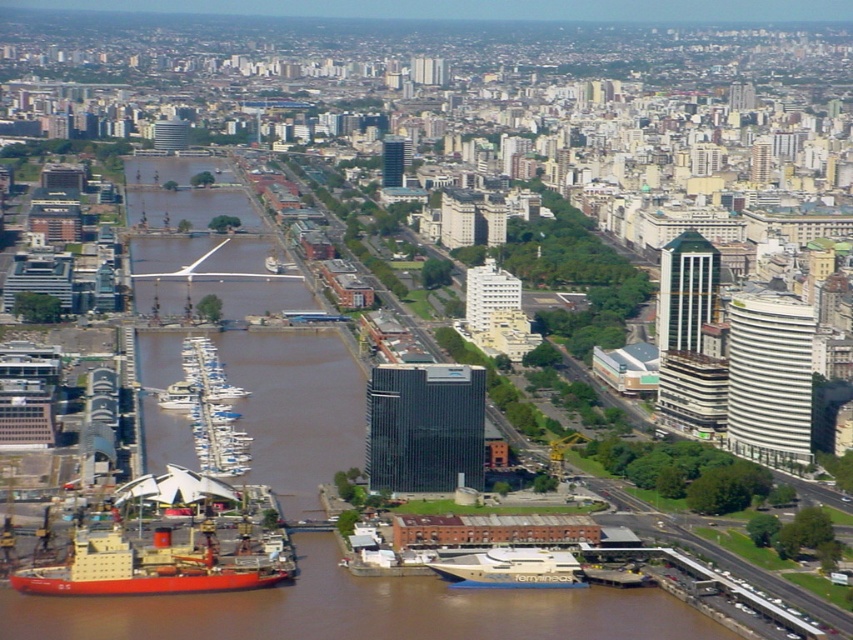
You are a drone operator tasked with capturing aerial footage of the city. Your drone has a maximum flight range of 80 meters from its starting point. If you position the drone above the red matte ship at lower left, can you capture footage of the gold polished yacht at lower center without exceeding the drone range?

The red matte ship at lower left and gold polished yacht at lower center are 75.44 meters apart. Since the distance between them is within the drone range of 80 meters, the drone can capture footage of the gold polished yacht at lower center without exceeding its maximum range.